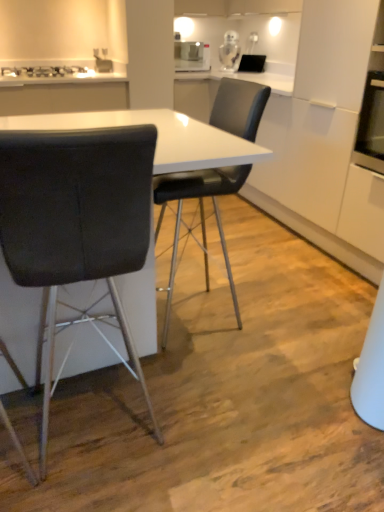
This screenshot has height=512, width=384. Identify the location of free space below black leather chair at center, which is the 1th chair from right to left (from a real-world perspective). (223, 306).